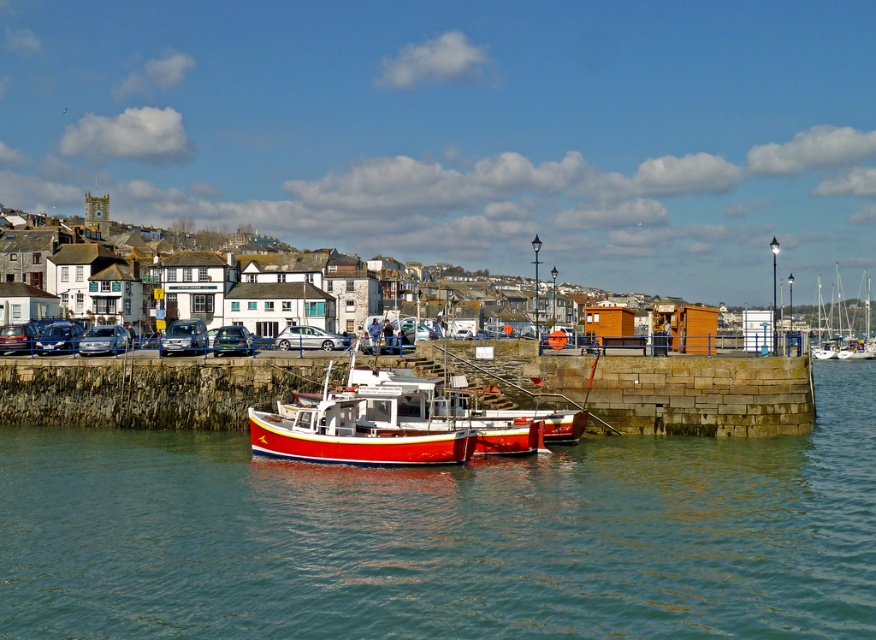
You are navigating a metallic silver van at center in a coastal marina. To avoid hitting the stone pier with the fishing boat, you need to know its position relative to the van. Is the van positioned to the left or right of the stone pier?

The metallic silver van at center is located at point (184, 337), which places it to the right of the stone pier. Therefore, the van is positioned to the right of the stone pier.

You are a photographer wanting to capture both the white wooden sailboat at right and the matte black car at left in the same frame. Based on their positions, which object should you position closer to the right side of your camera frame?

You should position the white wooden sailboat at right closer to the right side of your camera frame since it is located to the right of the matte black car at left.

You are a delivery driver who needs to park your vehicle in the marina parking lot. You see two cars, a satin silver car at center and a metallic blue car at center. Which car is blocking the parking space so you can park behind it?

The satin silver car at center is positioned over metallic blue car at center, so you can park behind the metallic blue car at center since it is underneath the satin silver car at center.